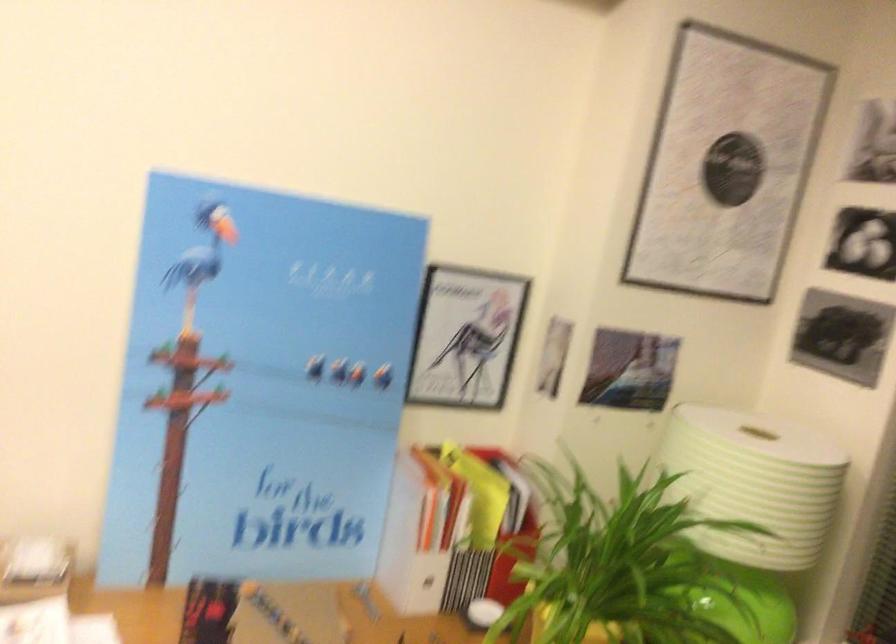
This screenshot has height=644, width=896. Find the location of `white file holder`. white file holder is located at coordinates (418, 533).